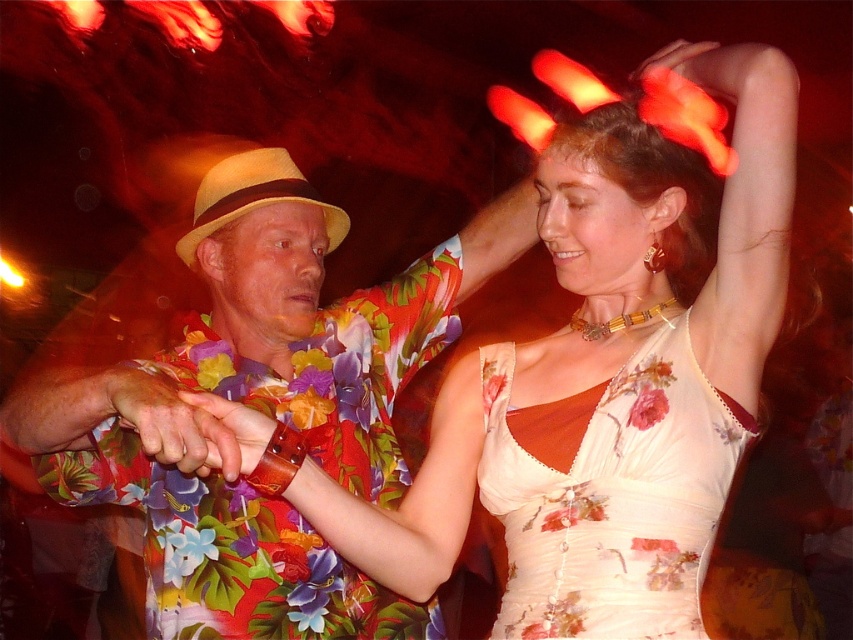
Can you confirm if floral silk dress at center is positioned to the right of beige straw cowboy hat at center?

Correct, you'll find floral silk dress at center to the right of beige straw cowboy hat at center.

Describe the element at coordinates (608, 493) in the screenshot. I see `floral silk dress at center` at that location.

At what (x,y) coordinates should I click in order to perform the action: click on floral silk dress at center. Please return your answer as a coordinate pair (x, y). Image resolution: width=853 pixels, height=640 pixels. Looking at the image, I should click on (608, 493).

Is white floral dress at center above floral silk dress at center?

Yes.

Locate an element on the screen. This screenshot has height=640, width=853. white floral dress at center is located at coordinates (606, 371).

At what (x,y) coordinates should I click in order to perform the action: click on white floral dress at center. Please return your answer as a coordinate pair (x, y). Looking at the image, I should click on (606, 371).

Is white floral dress at center thinner than beige straw cowboy hat at center?

In fact, white floral dress at center might be wider than beige straw cowboy hat at center.

Is point (721, 64) farther from viewer compared to point (242, 150)?

That is False.

The image size is (853, 640). Find the location of `white floral dress at center`. white floral dress at center is located at coordinates (606, 371).